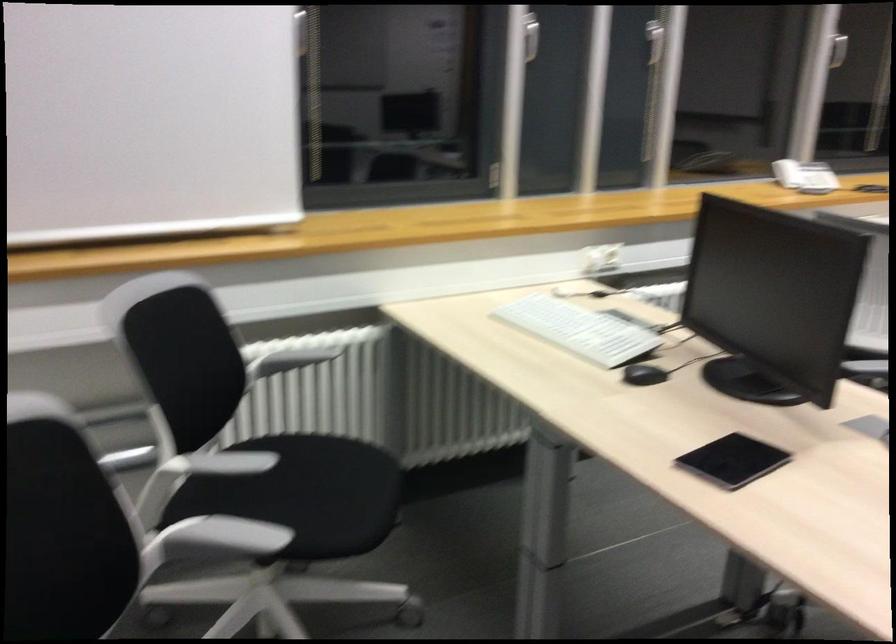
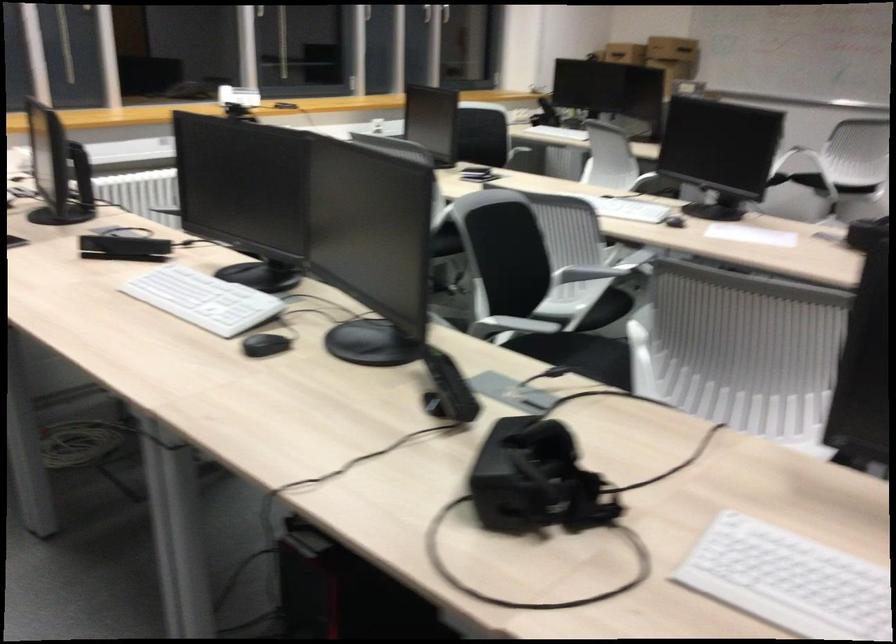
Locate, in the second image, the point that corresponds to point 794,156 in the first image.

(238, 96)